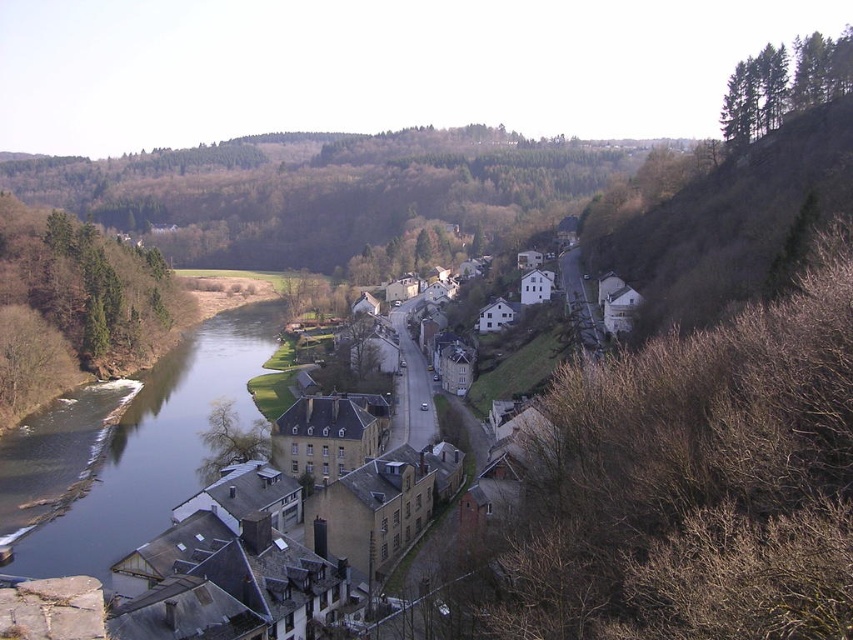
Consider the image. You are standing at the point with coordinates 0.5, 0.5 in this village scene. You want to walk towards the yellow stone buildings at center. In which direction should you head?

The yellow stone buildings at center are located at coordinates (303, 536). Since your current position is at (426, 320), you should head northeast to reach them.

From the picture: You are a drone operator tasked with capturing aerial footage of the village. You need to ensure that the bare soil at upper right is visible in your shot. Based on its coordinates, where should you position the camera relative to the village?

The bare soil at upper right is located at point (x=721, y=220), so you should position the camera to the upper right of the village to capture it in the shot.

You are planning to build a small garden between the bare soil at upper right and the green leafy trees at upper right. Given that the garden requires at least 100 feet of space, will there be enough room?

The distance between the bare soil at upper right and green leafy trees at upper right is 130.28 feet, which exceeds the required 100 feet. Therefore, there is sufficient space to build the garden.